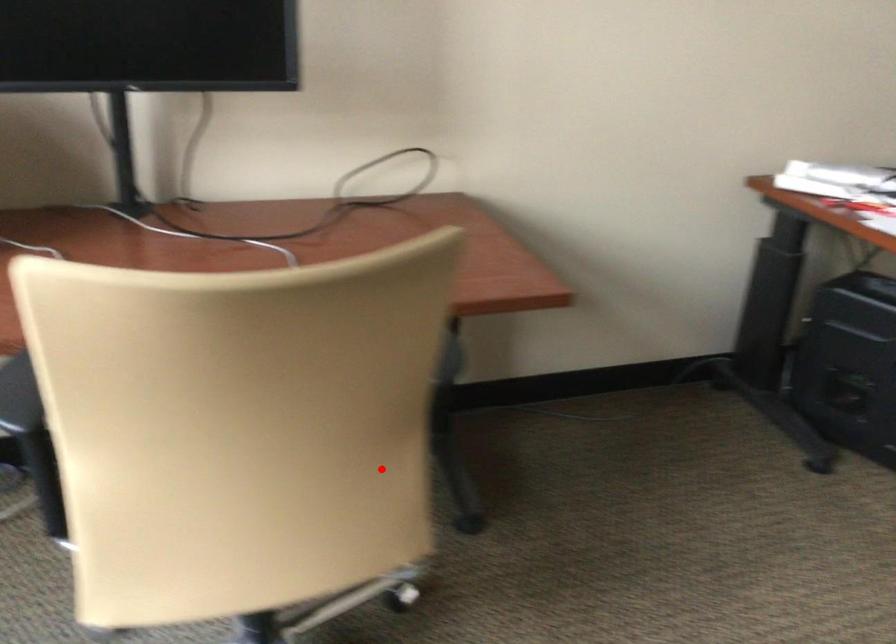
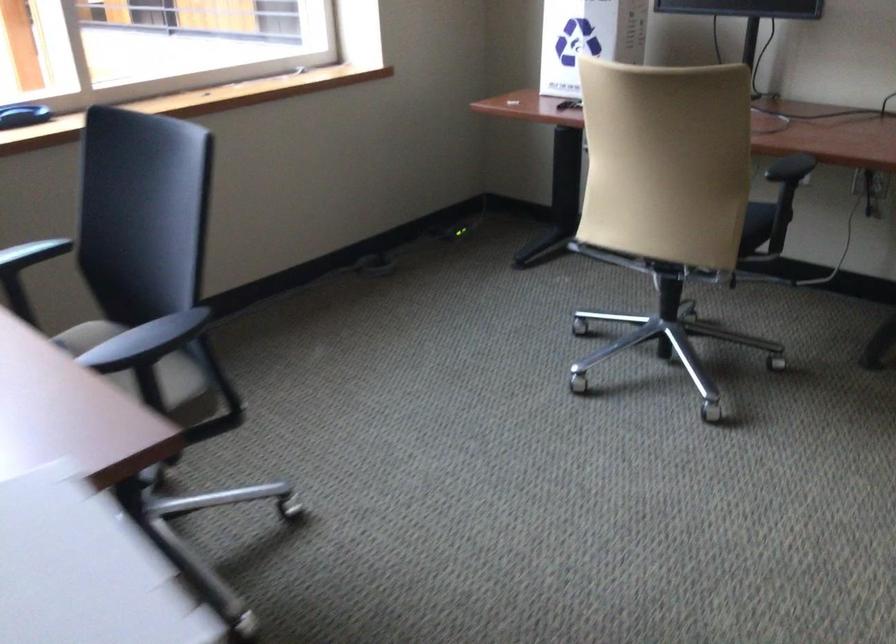
Question: I am providing you with two images of the same scene from different viewpoints. Image1 has a red point marked. In image2, the corresponding 3D location appears at what relative position? Reply with the corresponding letter.

Choices:
 (A) Closer
 (B) Farther

Answer: (B)